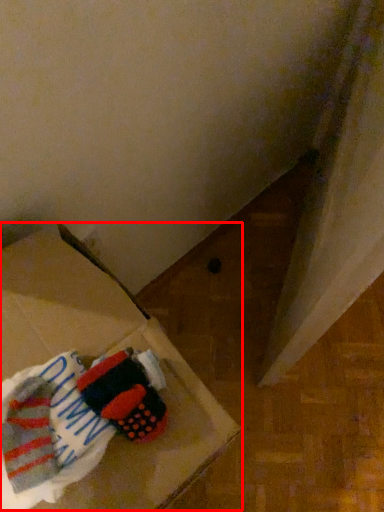
Question: From the image's perspective, where is cardboard box (annotated by the red box) located in relation to laundry in the image?

Choices:
 (A) below
 (B) above

Answer: (A)